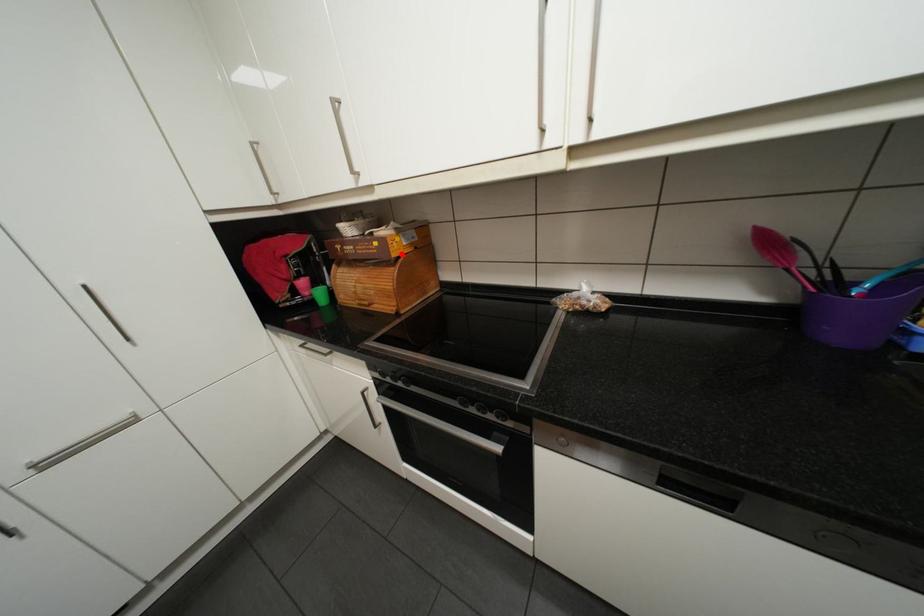
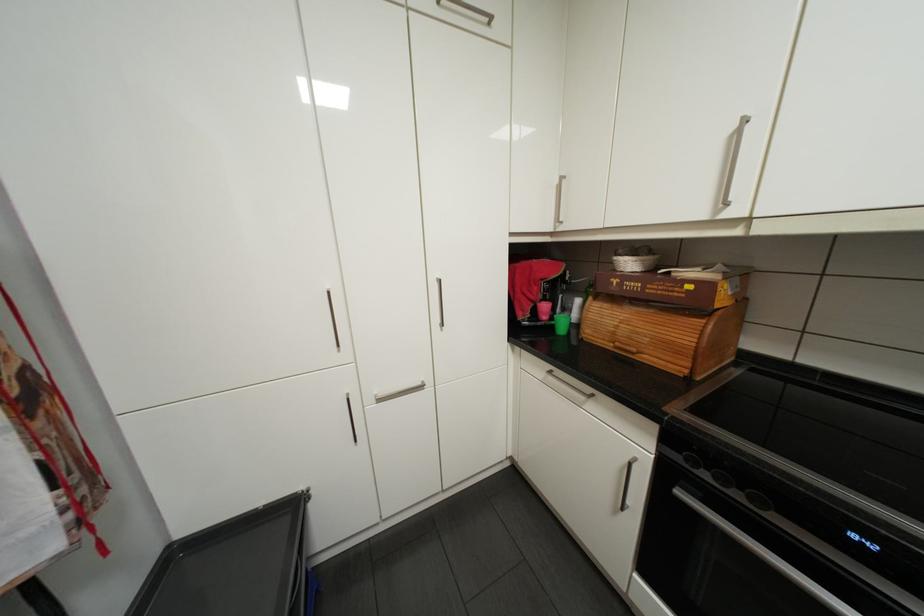
In the second image, find the point that corresponds to the highlighted location in the first image.

(725, 305)